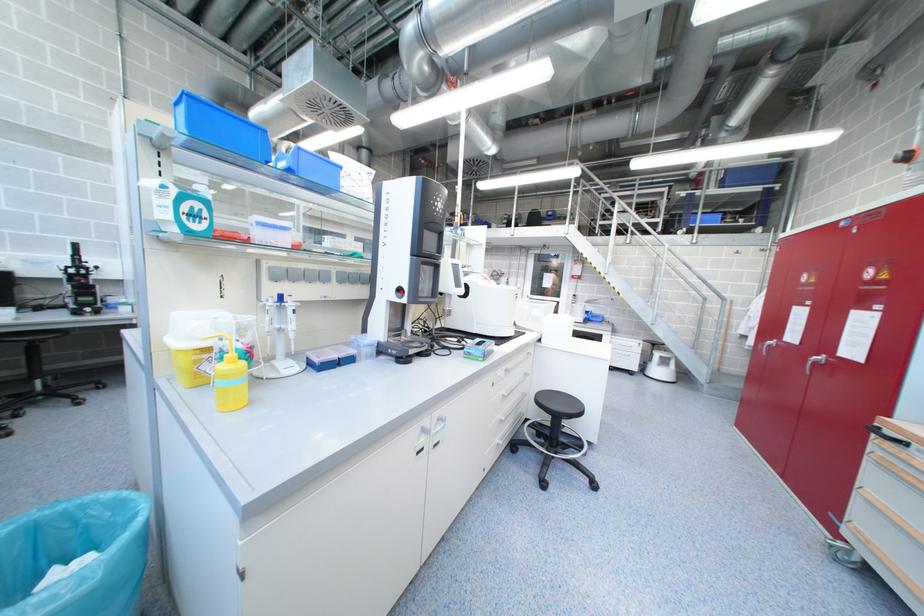
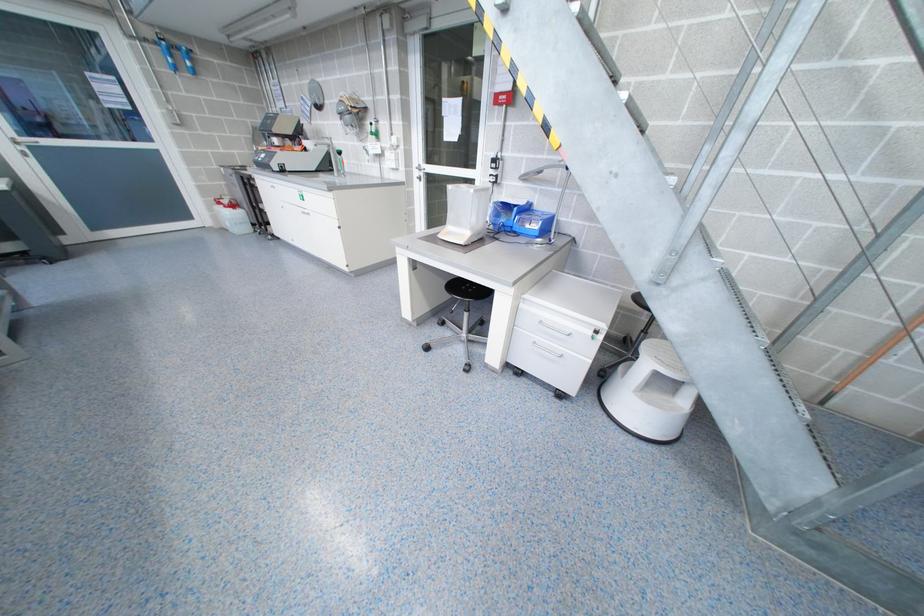
In a continuous first-person perspective shot, in which direction is the camera moving?

The cameraman moved toward right, forward.